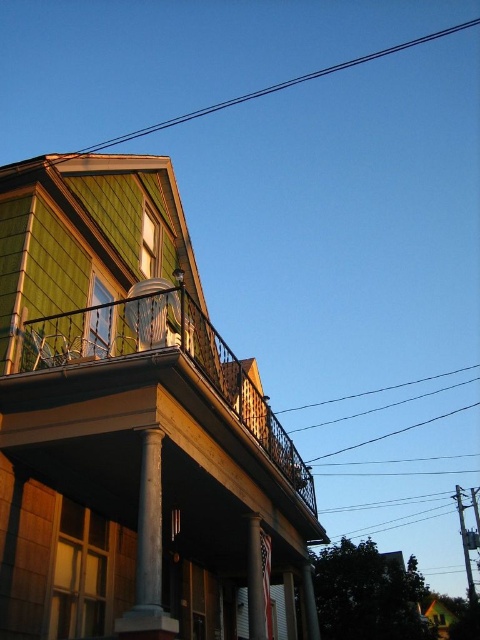
Does white marble column at center appear over white marble pillar at center?

Indeed, white marble column at center is positioned over white marble pillar at center.

Is white marble column at center closer to camera compared to white marble pillar at center?

Yes.

Is point (142, 596) behind point (254, 612)?

No, (142, 596) is in front of (254, 612).

What are the coordinates of `white marble column at center` in the screenshot? It's located at (148, 552).

Is white marble column at center closer to the viewer compared to black wire at upper center?

Yes, white marble column at center is closer to the viewer.

Does point (142, 541) come farther from viewer compared to point (472, 19)?

No, (142, 541) is closer to viewer.

The width and height of the screenshot is (480, 640). Identify the location of white marble column at center. (148, 552).

Locate an element on the screen. This screenshot has width=480, height=640. white marble column at center is located at coordinates (148, 552).

Which is above, wooden railing at upper center or black wire at upper center?

black wire at upper center is higher up.

Does wooden railing at upper center come behind black wire at upper center?

No.

Is point (69, 385) positioned in front of point (457, 29)?

Yes, it is in front of point (457, 29).

You are a GUI agent. You are given a task and a screenshot of the screen. Output one action in this format:
    pyautogui.click(x=<x>, y=<y>)
    Task: Click on the wooden railing at upper center
    This screenshot has height=640, width=480.
    Given the screenshot: What is the action you would take?
    pyautogui.click(x=159, y=380)